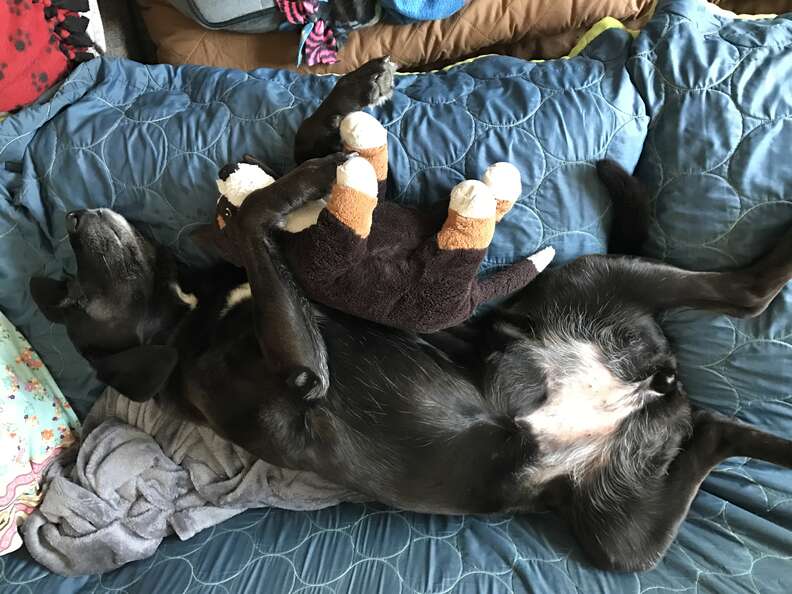
Find the location of a particular element. toy is located at coordinates (379, 255).